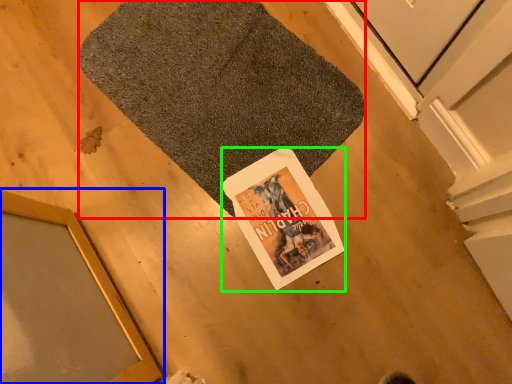
Question: Considering the real-world distances, which object is farthest from bath mat (highlighted by a red box)? window (highlighted by a blue box) or magazine (highlighted by a green box)?

Choices:
 (A) window
 (B) magazine

Answer: (A)